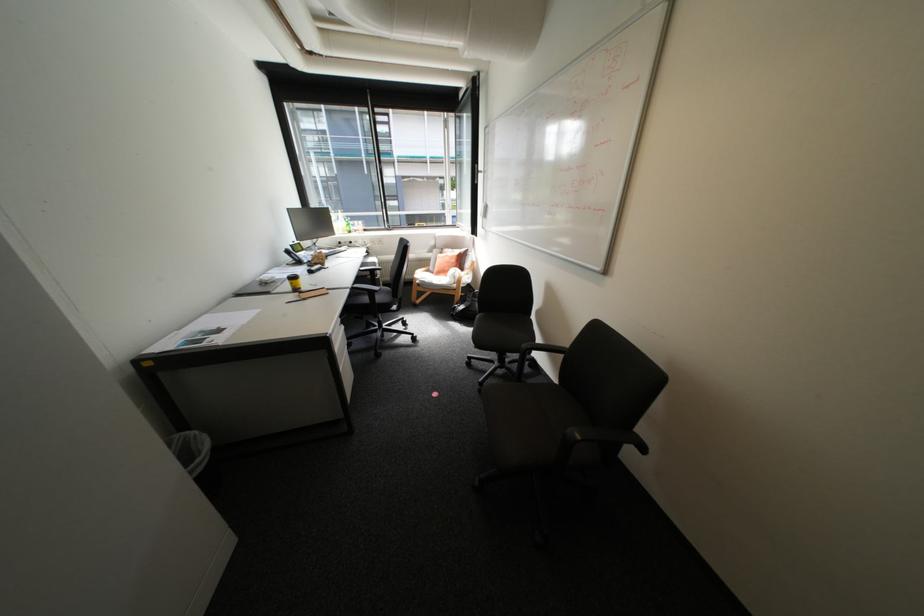
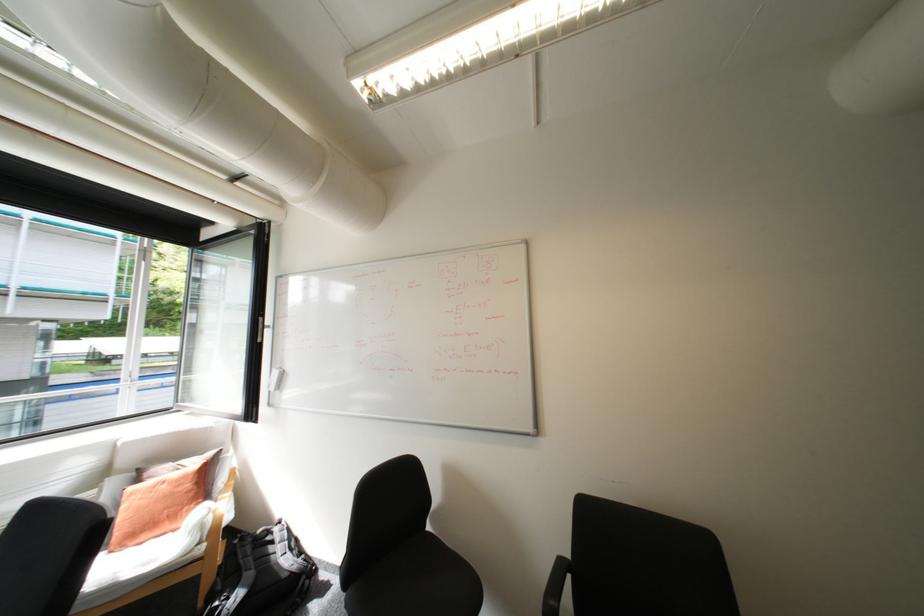
Find the pixel in the second image that matches (490,216) in the first image.

(277, 387)